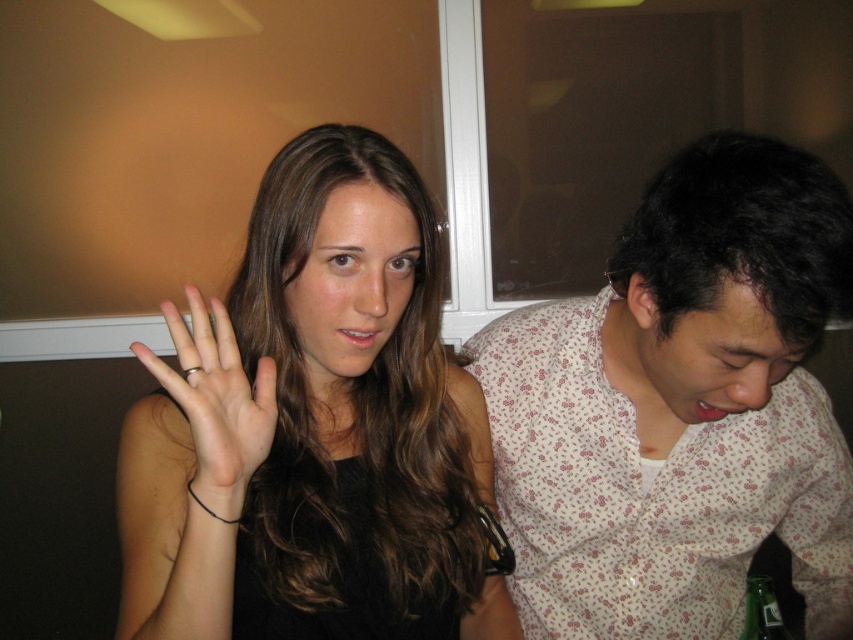
You are at a party and want to give a gift to the person wearing the gold metallic ring at center. Which direction should you walk from the white floral shirt at right to reach them?

The white floral shirt at right is to the right of the gold metallic ring at center, so you should walk to the left from the white floral shirt at right to reach the person with the gold metallic ring at center.

You are a photographer adjusting your camera settings. You notice the matte black hand at center and the white floral shirt at right in your frame. Which object should you focus on to ensure sharpness if you want to prioritize the closer subject?

The matte black hand at center is closer to the viewer than the white floral shirt at right, so you should focus on the matte black hand at center to ensure sharpness.

Consider the image. You are a photographer adjusting the camera focus. You notice the matte black hand at center and the gold metallic ring at center in your frame. Which object should you focus on first to ensure the closer one is sharp?

The matte black hand at center is in front of the gold metallic ring at center, so you should focus on the matte black hand at center first to ensure the closer object is sharp.